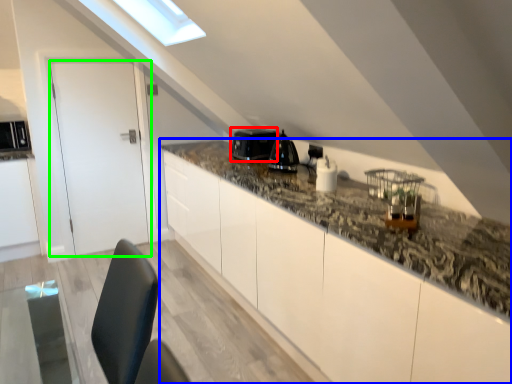
Question: Considering the real-world distances, which object is farthest from appliance (highlighted by a red box)? countertop (highlighted by a blue box) or door (highlighted by a green box)?

Choices:
 (A) countertop
 (B) door

Answer: (B)